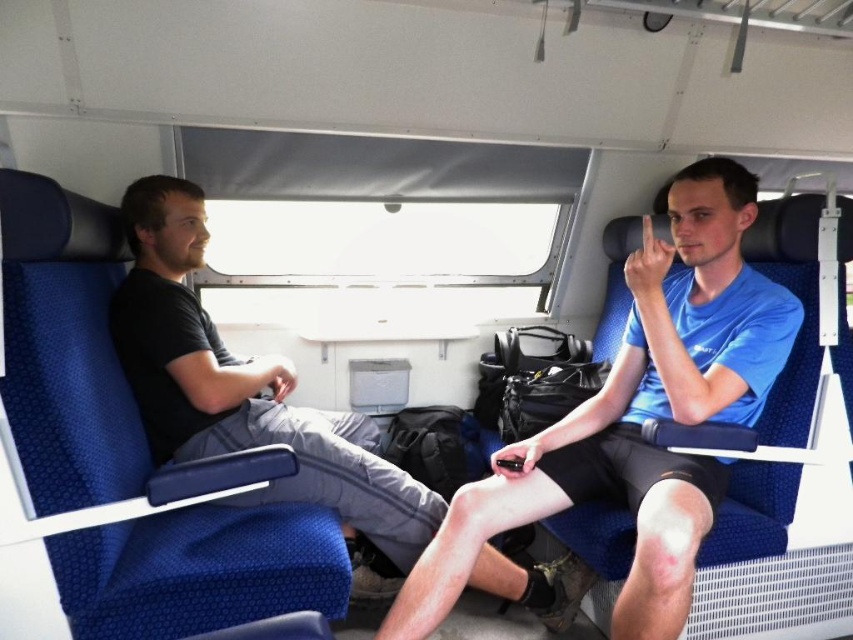
Question: Among these objects, which one is nearest to the camera?

Choices:
 (A) blue matte shirt at right
 (B) black cotton shirt at left

Answer: (A)

Question: Is blue matte shirt at right in front of black cotton shirt at left?

Choices:
 (A) yes
 (B) no

Answer: (A)

Question: Does blue matte shirt at right have a lesser width compared to black cotton shirt at left?

Choices:
 (A) yes
 (B) no

Answer: (A)

Question: Among these points, which one is farthest from the camera?

Choices:
 (A) (206, 394)
 (B) (549, 468)

Answer: (A)

Question: Which point appears farthest from the camera in this image?

Choices:
 (A) (730, 348)
 (B) (132, 236)

Answer: (B)

Question: Can you confirm if blue matte shirt at right is positioned below black cotton shirt at left?

Choices:
 (A) no
 (B) yes

Answer: (A)